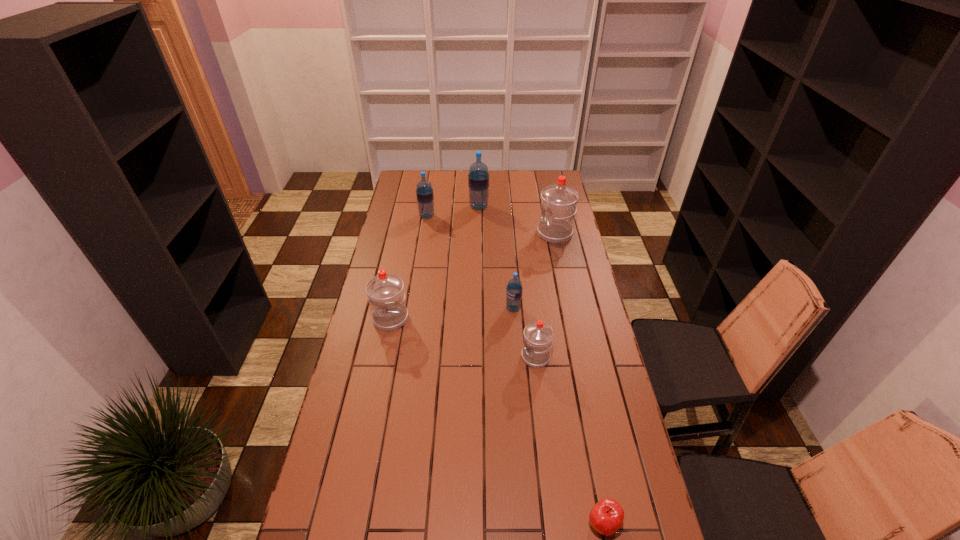
Find the location of `the third object from left to right`. the third object from left to right is located at coordinates (478, 178).

Where is `the biggest blue water bottle`? Image resolution: width=960 pixels, height=540 pixels. the biggest blue water bottle is located at coordinates tap(478, 178).

Identify the location of the rightmost water bottle. (559, 201).

At what (x,y) coordinates should I click in order to perform the action: click on the rightmost white water bottle. Please return your answer as a coordinate pair (x, y). This screenshot has width=960, height=540. Looking at the image, I should click on (559, 201).

Find the location of a particular element. The image size is (960, 540). the leftmost blue water bottle is located at coordinates (424, 192).

Image resolution: width=960 pixels, height=540 pixels. In order to click on the leftmost white water bottle in this screenshot , I will do `click(385, 292)`.

Identify the location of the second biggest white water bottle. The image size is (960, 540). (385, 292).

You are a GUI agent. You are given a task and a screenshot of the screen. Output one action in this format:
    pyautogui.click(x=<x>, y=<y>)
    Task: Click on the smallest blue water bottle
    
    Given the screenshot: What is the action you would take?
    pyautogui.click(x=514, y=289)

Where is `the rightmost blue water bottle`? the rightmost blue water bottle is located at coordinates (514, 289).

This screenshot has height=540, width=960. I want to click on the sixth farthest object, so click(538, 336).